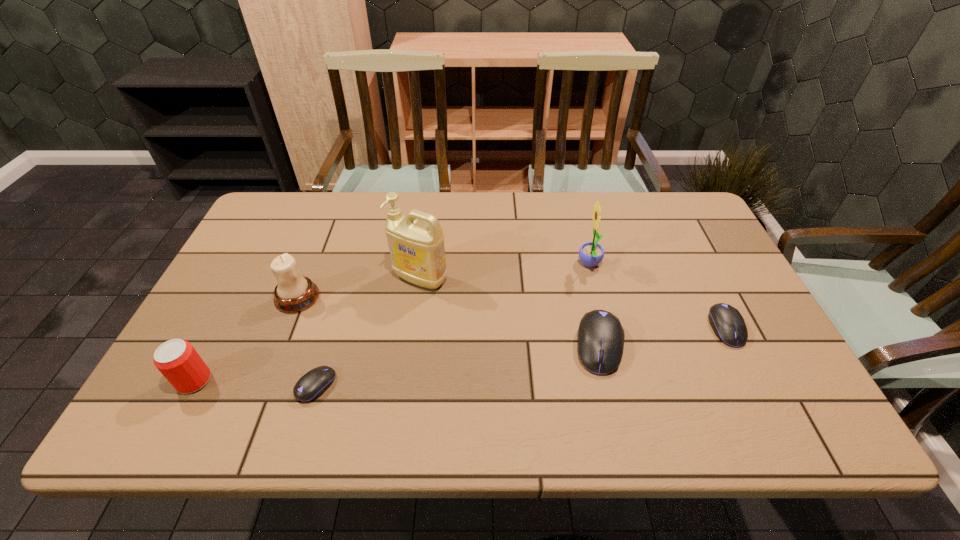
Find the location of a particular element. free space at the right edge is located at coordinates (684, 289).

Identify the location of vacant region at the far left corner of the desktop. Image resolution: width=960 pixels, height=540 pixels. (274, 201).

Find the location of `vacant space at the far right corner of the desktop`. vacant space at the far right corner of the desktop is located at coordinates (651, 195).

Locate an element on the screen. This screenshot has width=960, height=540. free space between the detergent and the third shortest object is located at coordinates (510, 312).

I want to click on vacant area that lies between the beer can and the fifth object from right to left, so click(x=255, y=383).

Where is `free space between the beer can and the candle holder`? Image resolution: width=960 pixels, height=540 pixels. free space between the beer can and the candle holder is located at coordinates (246, 339).

You are a GUI agent. You are given a task and a screenshot of the screen. Output one action in this format:
    pyautogui.click(x=<x>, y=<y>)
    Task: Click on the free space between the leftmost computer mouse and the detergent
    The width and height of the screenshot is (960, 540).
    Given the screenshot: What is the action you would take?
    pyautogui.click(x=369, y=332)

Identify the location of free space between the sixth tallest object and the sixth object from right to left. Image resolution: width=960 pixels, height=540 pixels. (512, 313).

This screenshot has height=540, width=960. Find the location of `free area in between the sunflower and the fifth object from right to left`. free area in between the sunflower and the fifth object from right to left is located at coordinates (453, 325).

Where is `vacant space that's between the beer can and the second computer mouse from left to right`? vacant space that's between the beer can and the second computer mouse from left to right is located at coordinates (396, 363).